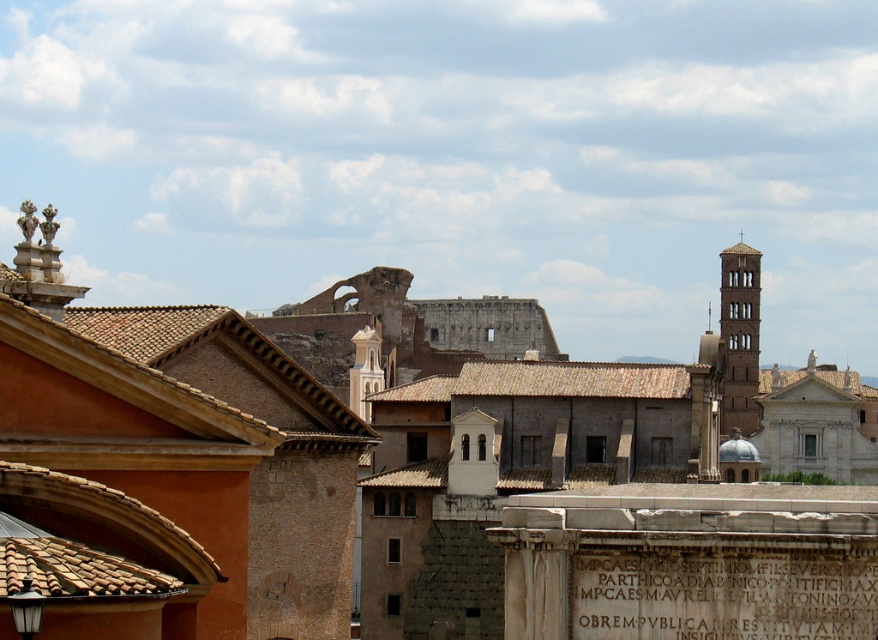
Which is more to the left, brown stone building at center or brown stone tower at right?

Positioned to the left is brown stone building at center.

Does point (106, 385) come farther from viewer compared to point (747, 348)?

No, it is in front of (747, 348).

Which is in front, point (55, 572) or point (756, 305)?

Point (55, 572)

Where is `brown stone building at center`? This screenshot has width=878, height=640. brown stone building at center is located at coordinates (160, 460).